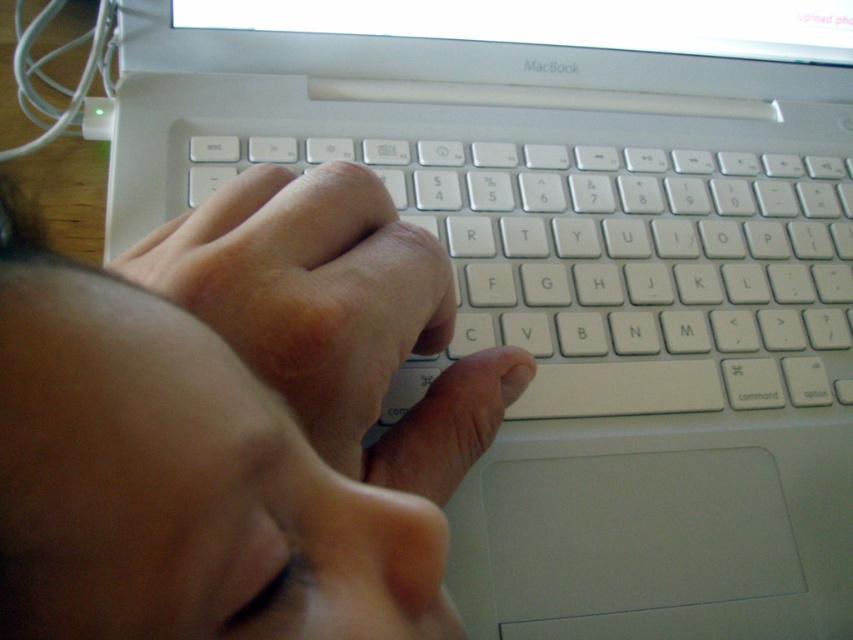
You are designing a desk layout and need to ensure there is enough space for both the matte white hand at center and the white plastic keyboard at center. Based on their sizes, which object requires more horizontal space on the desk?

The white plastic keyboard at center requires more horizontal space because its width is greater than the matte white hand at center.

You are a graphic designer working on a project and need to place a new element precisely on the screen. You see the point at coordinates (236,422) on your MacBook keyboard. Where should you place this element relative to the MacBook logo at top center?

The point at coordinates (236,422) is located at the matte white hand at center, which is below and to the right of the MacBook logo at top center. Therefore, you should place the new element below and to the right of the MacBook logo at top center.

You are designing a new keyboard cover that needs to cover both the matte white hand at center and the white plastic keyboard at center. Based on their sizes, which object should the cover be designed to accommodate in terms of height?

The matte white hand at center is not as tall as the white plastic keyboard at center, so the cover should be designed to accommodate the height of the white plastic keyboard at center.